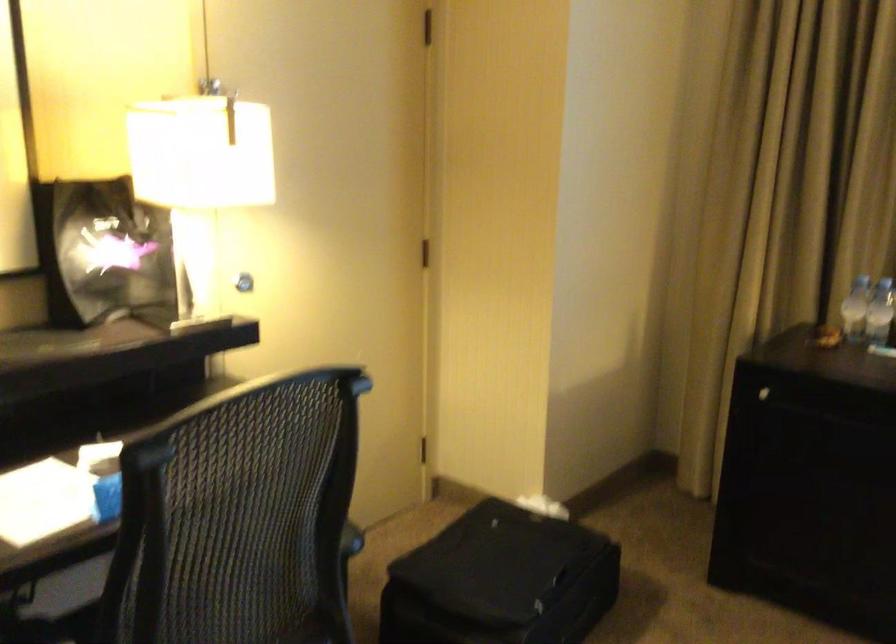
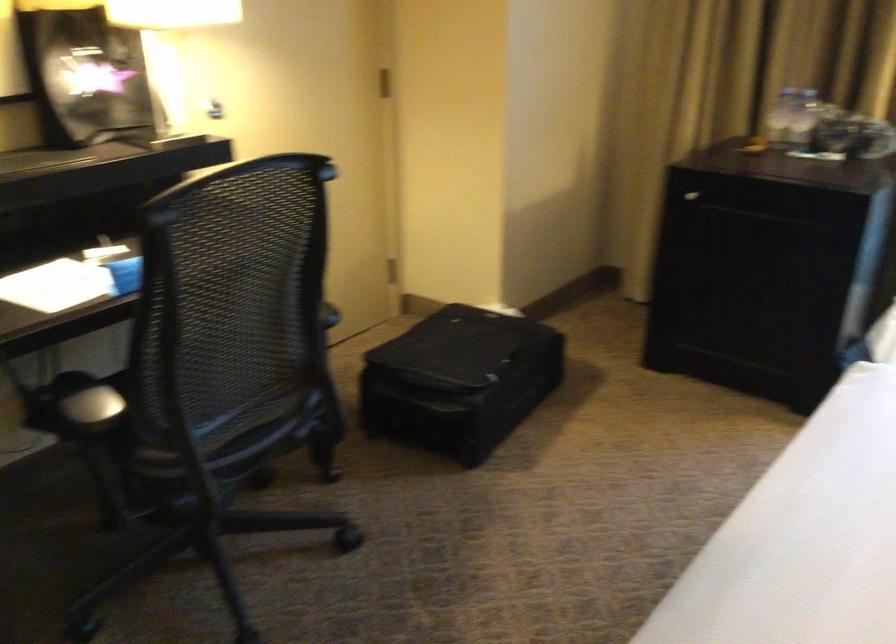
Question: Which direction would the cameraman need to move to produce the second image? Reply with the corresponding letter.

Choices:
 (A) Left
 (B) Right
 (C) Forward
 (D) Backward

Answer: (D)